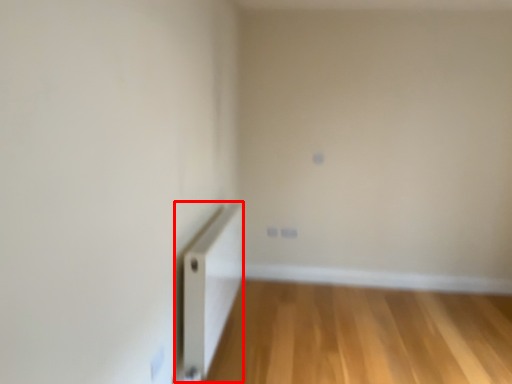
Question: From the image's perspective, what is the correct spatial relationship of radiator (annotated by the red box) in relation to corridor?

Choices:
 (A) above
 (B) below

Answer: (A)